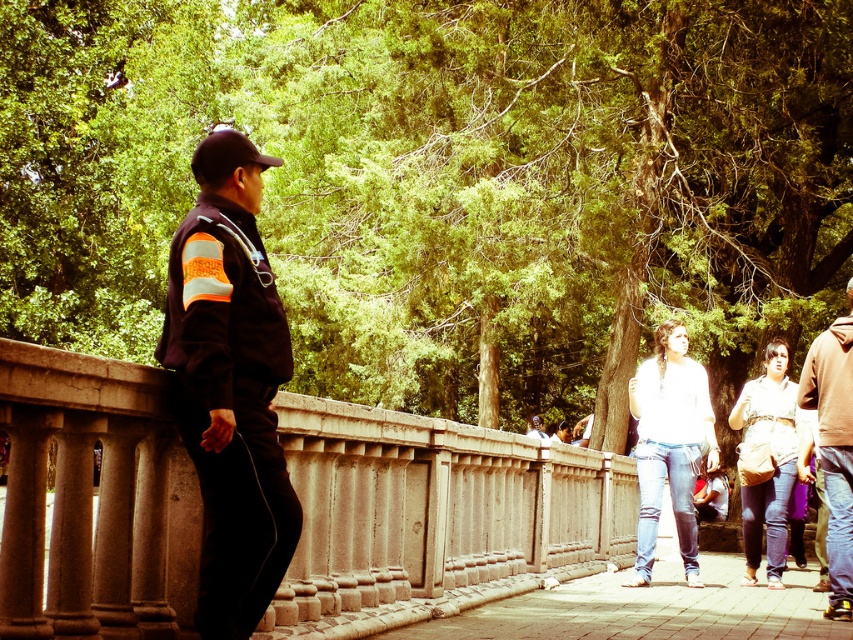
In the scene shown: You are a park visitor and see the dark blue uniform at left and the paved stone sidewalk at center. Which object is closer to you?

The dark blue uniform at left is closer to you because it is positioned over the paved stone sidewalk at center.

You are standing on the pathway and want to pick up the brown leather jacket at right. Do you need to step over the smooth concrete railing at center to reach it?

The smooth concrete railing at center is closer to the viewer than the brown leather jacket at right, so you would need to step over the smooth concrete railing at center to reach the brown leather jacket at right.

You are standing at the edge of a park pathway with a stone railing. A person in a dark blue uniform at left is nearby. If you want to approach them, how many steps of 3 feet each would you need to take to reach them?

The dark blue uniform at left and viewer are 16.33 feet apart. To reach them, you would need to take approximately 6 steps of 3 feet each, as 16.33 divided by 3 is approximately 5.44, which rounds up to 6 steps.